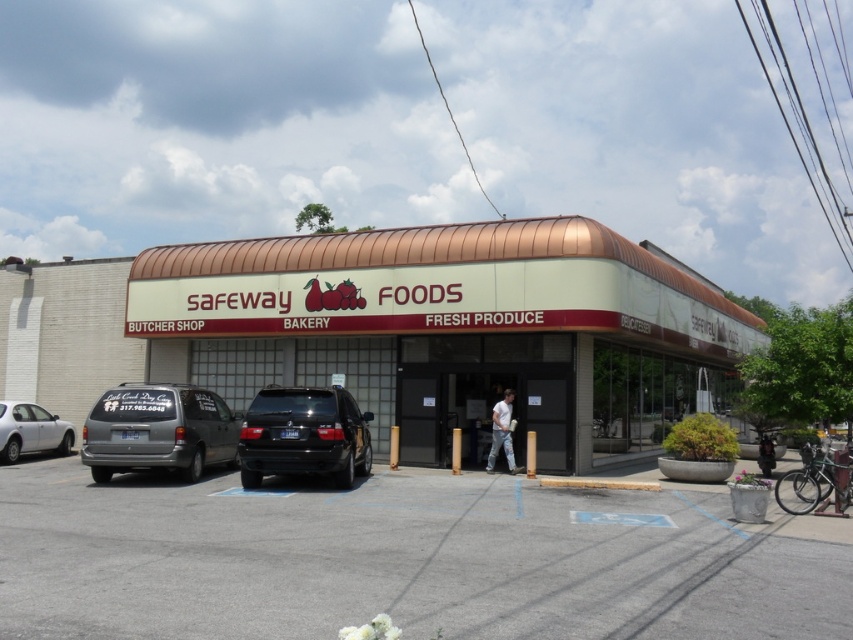
Which of these two, white matte building at center or silver metallic sedan at left, stands shorter?

silver metallic sedan at left is shorter.

Which is above, white matte building at center or silver metallic sedan at left?

white matte building at center is above.

Image resolution: width=853 pixels, height=640 pixels. I want to click on white matte building at center, so click(457, 326).

Can you confirm if gray asphalt parking lot at center is bigger than white matte building at center?

No.

Between gray asphalt parking lot at center and white matte building at center, which one has more height?

Standing taller between the two is white matte building at center.

Locate an element on the screen. This screenshot has width=853, height=640. gray asphalt parking lot at center is located at coordinates (405, 560).

Can you confirm if silver metallic van at left is bigger than black matte suv at center?

Yes, silver metallic van at left is bigger than black matte suv at center.

Does point (102, 442) come closer to viewer compared to point (332, 445)?

That is False.

Locate an element on the screen. This screenshot has height=640, width=853. silver metallic van at left is located at coordinates (158, 429).